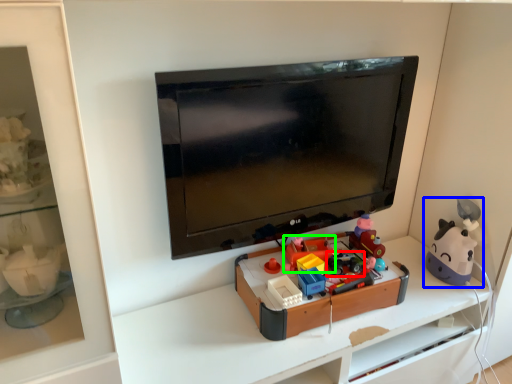
Question: Which object is positioned farthest from toy (highlighted by a red box)? Select from toy (highlighted by a blue box) and toy (highlighted by a green box).

Choices:
 (A) toy
 (B) toy

Answer: (A)